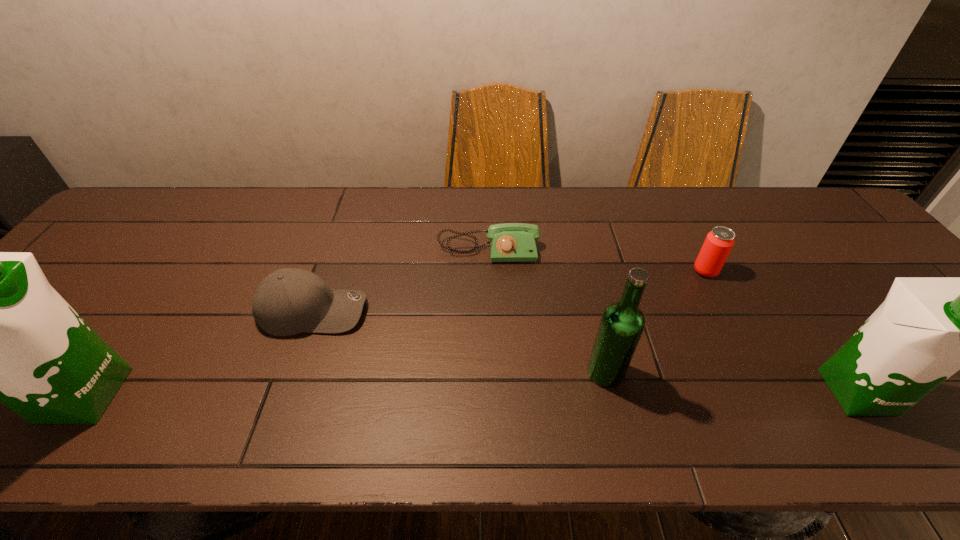
The width and height of the screenshot is (960, 540). I want to click on vacant space located 0.140m on the front-facing side of the tallest object, so click(191, 395).

What are the coordinates of `free point located on the dial of the shortest object` in the screenshot? It's located at (491, 318).

Locate an element on the screen. vacant space located 0.280m on the front of the second object from right to left is located at coordinates (756, 371).

Where is `vacant space located 0.170m on the front brim of the second object from left to right`? vacant space located 0.170m on the front brim of the second object from left to right is located at coordinates [x=436, y=311].

The image size is (960, 540). I want to click on free space located 0.120m on the back of the third object from right to left, so click(x=592, y=316).

In order to click on beer bottle that is positioned at the near edge in this screenshot , I will do `click(622, 323)`.

You are a GUI agent. You are given a task and a screenshot of the screen. Output one action in this format:
    pyautogui.click(x=<x>, y=<y>)
    Task: Click on the free region at the far edge
    Image resolution: width=960 pixels, height=540 pixels.
    Given the screenshot: What is the action you would take?
    pyautogui.click(x=567, y=212)

In the image, there is a desktop. Identify the location of blank space at the near edge. Image resolution: width=960 pixels, height=540 pixels. (711, 381).

Locate an element on the screen. The width and height of the screenshot is (960, 540). vacant space at the far right corner of the desktop is located at coordinates (x=803, y=190).

The width and height of the screenshot is (960, 540). I want to click on empty location between the leftmost object and the beer can, so click(x=395, y=333).